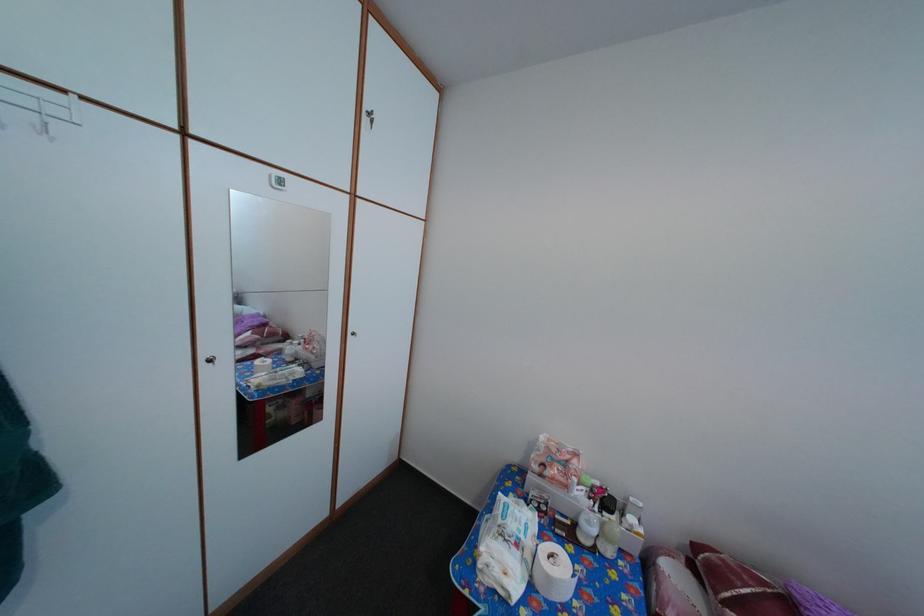
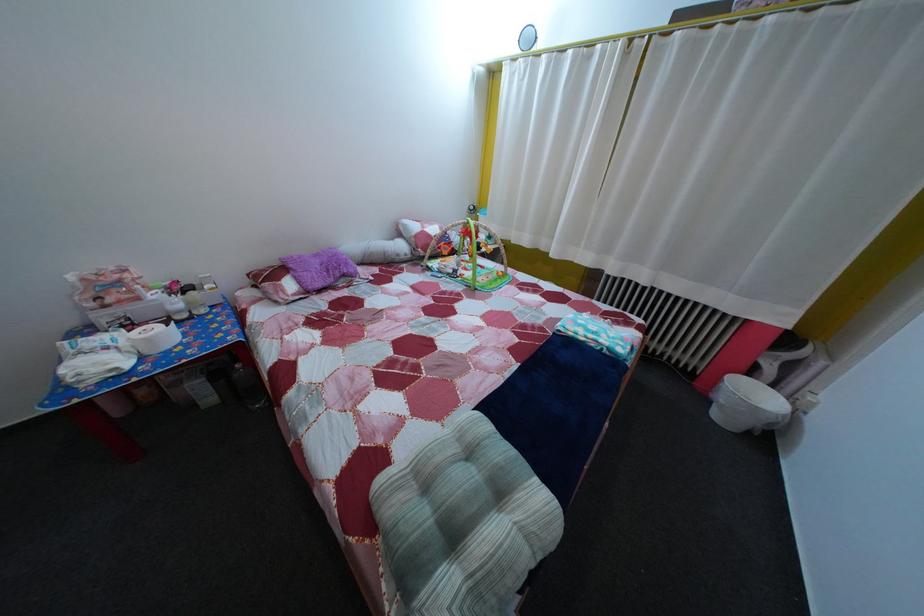
The point at (558,586) is marked in the first image. Where is the corresponding point in the second image?

(157, 347)